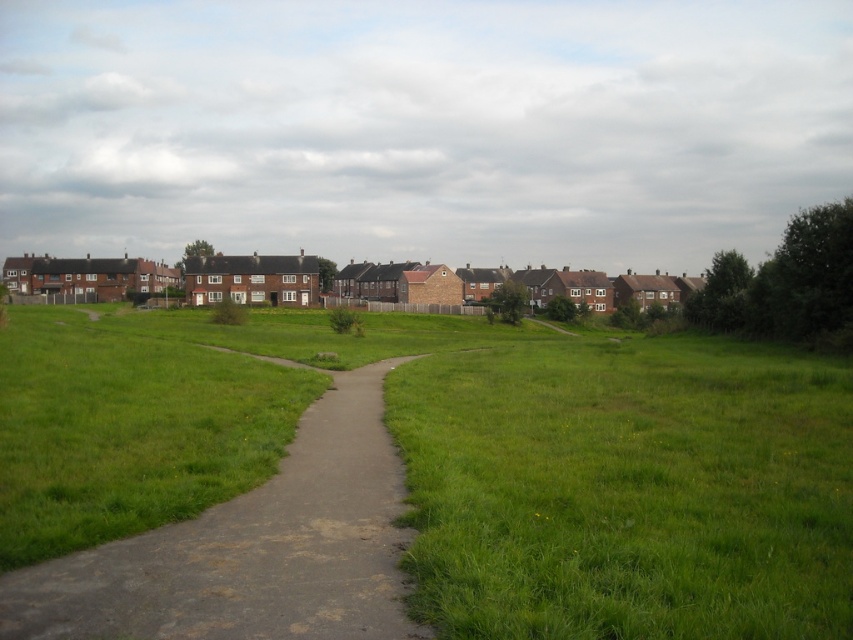
Who is positioned more to the right, green grass at center or dull gray concrete path at center?

green grass at center is more to the right.

Is green grass at center smaller than dull gray concrete path at center?

Actually, green grass at center might be larger than dull gray concrete path at center.

Between point (300, 330) and point (381, 536), which one is positioned behind?

The point (300, 330) is more distant.

Where is `green grass at center`? The width and height of the screenshot is (853, 640). green grass at center is located at coordinates coord(466,461).